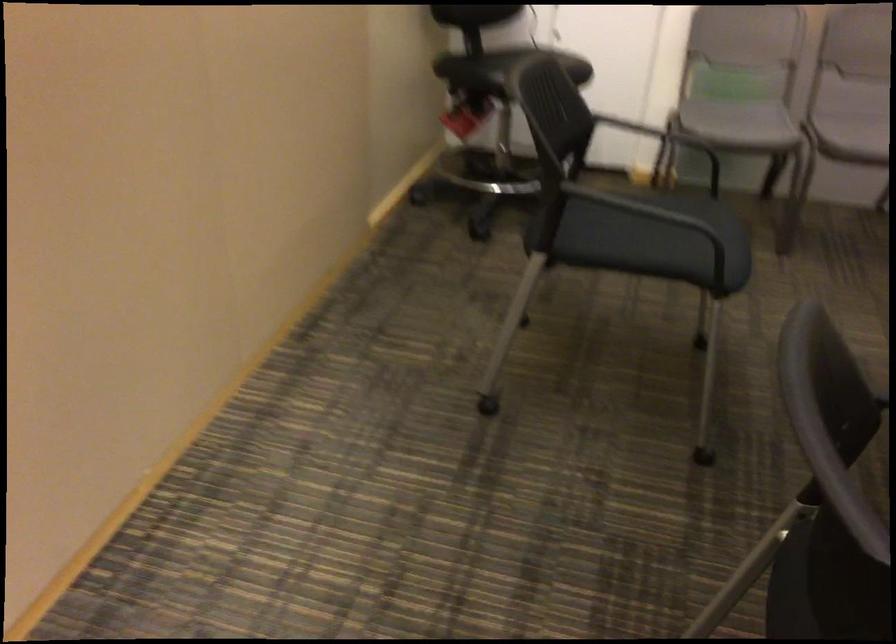
Image resolution: width=896 pixels, height=644 pixels. Find the location of `black chair sitting surface`. black chair sitting surface is located at coordinates (826, 585).